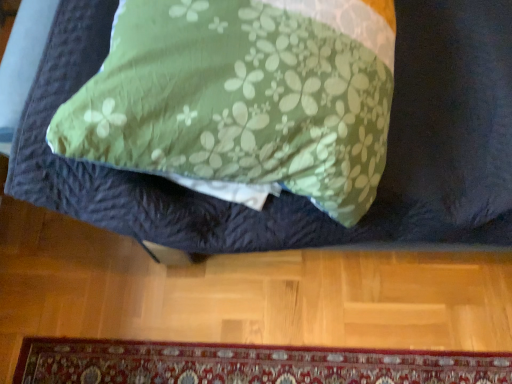
This screenshot has height=384, width=512. Find the location of `carpeted mat at lower center`. carpeted mat at lower center is located at coordinates (246, 364).

What do you see at coordinates (246, 364) in the screenshot? This screenshot has width=512, height=384. I see `carpeted mat at lower center` at bounding box center [246, 364].

Measure the distance between green floral fabric at center and camera.

They are 24.38 inches apart.

What do you see at coordinates (288, 192) in the screenshot? I see `green floral fabric at center` at bounding box center [288, 192].

Find the location of a particular element. The height and width of the screenshot is (384, 512). green floral fabric at center is located at coordinates (288, 192).

This screenshot has width=512, height=384. I want to click on carpeted mat at lower center, so pyautogui.click(x=246, y=364).

Considering the relative positions of green floral fabric at center and carpeted mat at lower center in the image provided, is green floral fabric at center to the left of carpeted mat at lower center from the viewer's perspective?

No, green floral fabric at center is not to the left of carpeted mat at lower center.

Is green floral fabric at center closer to the viewer compared to carpeted mat at lower center?

Yes, green floral fabric at center is closer to the camera.

Is point (449, 185) in front of point (223, 367)?

Yes.

From the image's perspective, which object appears higher, green floral fabric at center or carpeted mat at lower center?

green floral fabric at center, from the image's perspective.

From a real-world perspective, is green floral fabric at center positioned above or below carpeted mat at lower center?

green floral fabric at center is above carpeted mat at lower center.

Based on the photo, does green floral fabric at center have a greater width compared to carpeted mat at lower center?

Correct, the width of green floral fabric at center exceeds that of carpeted mat at lower center.

Based on the photo, considering the relative sizes of green floral fabric at center and carpeted mat at lower center in the image provided, is green floral fabric at center taller than carpeted mat at lower center?

Yes, green floral fabric at center is taller than carpeted mat at lower center.

Can you confirm if green floral fabric at center is smaller than carpeted mat at lower center?

No, green floral fabric at center is not smaller than carpeted mat at lower center.

Is carpeted mat at lower center completely or partially inside green floral fabric at center?

Actually, carpeted mat at lower center is outside green floral fabric at center.

Are green floral fabric at center and carpeted mat at lower center located far from each other?

Actually, green floral fabric at center and carpeted mat at lower center are a little close together.

Is green floral fabric at center oriented away from carpeted mat at lower center?

No, carpeted mat at lower center is not at the back of green floral fabric at center.

How much distance is there between green floral fabric at center and carpeted mat at lower center?

25.01 inches.

You are a GUI agent. You are given a task and a screenshot of the screen. Output one action in this format:
    pyautogui.click(x=<x>, y=<y>)
    Task: Click on the furniture above the carpeted mat at lower center (from the image's perspective)
    
    Given the screenshot: What is the action you would take?
    pyautogui.click(x=288, y=192)

Does carpeted mat at lower center appear on the left side of green floral fabric at center?

Indeed, carpeted mat at lower center is positioned on the left side of green floral fabric at center.

Which is behind, carpeted mat at lower center or green floral fabric at center?

carpeted mat at lower center is further away from the camera.

Is point (214, 360) positioned after point (17, 180)?

That is True.

From the image's perspective, would you say carpeted mat at lower center is shown under green floral fabric at center?

Correct, carpeted mat at lower center appears lower than green floral fabric at center in the image.

From a real-world perspective, is carpeted mat at lower center positioned under green floral fabric at center based on gravity?

Yes.

Which of these two, carpeted mat at lower center or green floral fabric at center, is wider?

With larger width is green floral fabric at center.

From their relative heights in the image, would you say carpeted mat at lower center is taller or shorter than green floral fabric at center?

Clearly, carpeted mat at lower center is shorter compared to green floral fabric at center.

Who is bigger, carpeted mat at lower center or green floral fabric at center?

green floral fabric at center is bigger.

Consider the image. Do you think carpeted mat at lower center is within green floral fabric at center, or outside of it?

carpeted mat at lower center exists outside the volume of green floral fabric at center.

Is carpeted mat at lower center with green floral fabric at center?

No, carpeted mat at lower center is not touching green floral fabric at center.

Looking at this image, is carpeted mat at lower center looking in the opposite direction of green floral fabric at center?

No, carpeted mat at lower center is not facing away from green floral fabric at center.

How different are the orientations of carpeted mat at lower center and green floral fabric at center in degrees?

They differ by 90.7 degrees in their facing directions.

How far apart are carpeted mat at lower center and green floral fabric at center?

carpeted mat at lower center and green floral fabric at center are 25.01 inches apart.

You are a GUI agent. You are given a task and a screenshot of the screen. Output one action in this format:
    pyautogui.click(x=<x>, y=<y>)
    Task: Click on the furniture in front of the carpeted mat at lower center
    
    Given the screenshot: What is the action you would take?
    pyautogui.click(x=288, y=192)

Image resolution: width=512 pixels, height=384 pixels. What are the coordinates of `mat below the green floral fabric at center (from a real-world perspective)` in the screenshot? It's located at (246, 364).

This screenshot has height=384, width=512. I want to click on furniture above the carpeted mat at lower center (from the image's perspective), so click(288, 192).